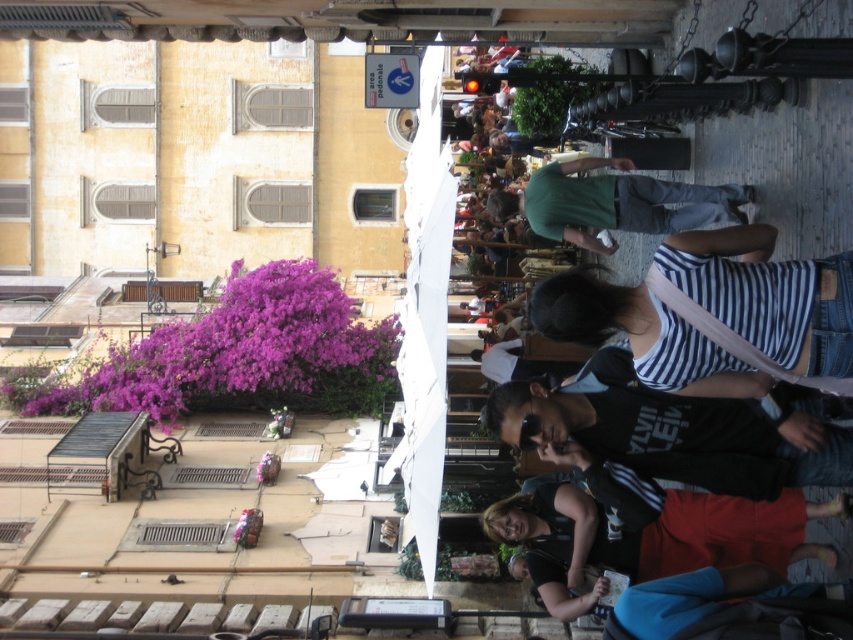
Question: Considering the relative positions of striped cotton shirt at center and red skirt at lower right in the image provided, where is striped cotton shirt at center located with respect to red skirt at lower right?

Choices:
 (A) below
 (B) above

Answer: (B)

Question: Which object is positioned closest to the green fabric shirt at center?

Choices:
 (A) red skirt at lower right
 (B) striped cotton shirt at center

Answer: (A)

Question: Does striped cotton shirt at center come in front of red skirt at lower right?

Choices:
 (A) no
 (B) yes

Answer: (B)

Question: Which object is the farthest from the red skirt at lower right?

Choices:
 (A) striped cotton shirt at center
 (B) green fabric shirt at center

Answer: (A)

Question: Does striped cotton shirt at center appear on the left side of green fabric shirt at center?

Choices:
 (A) no
 (B) yes

Answer: (A)

Question: Which point appears closest to the camera in this image?

Choices:
 (A) (814, 387)
 (B) (614, 224)

Answer: (A)